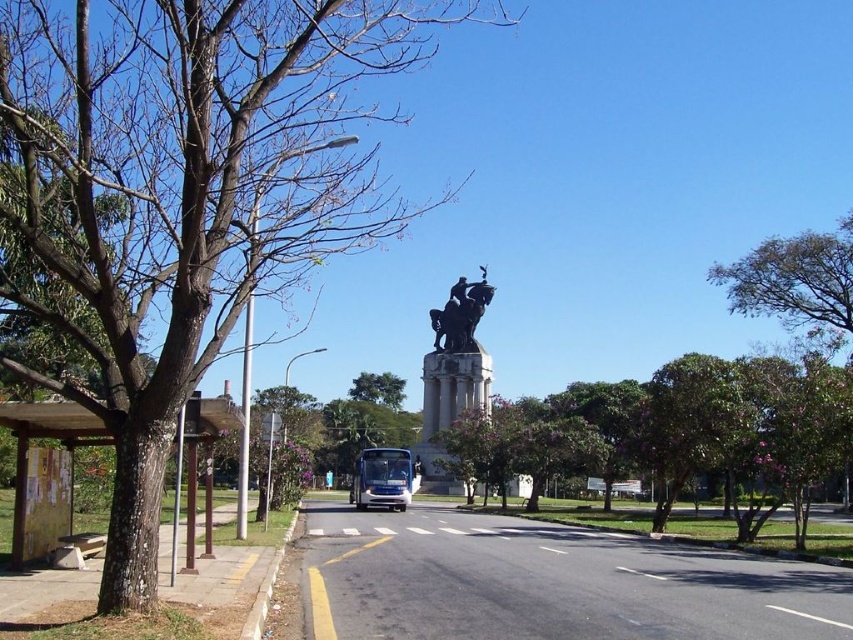
From the picture: You are a tourist standing in the park and want to take a photo of the polished bronze statue at center without the white glossy bus at center appearing in the frame. Which direction should you move to ensure the statue is visible but the bus is out of sight?

Move to the right side of the polished bronze statue at center so that the white glossy bus at center is no longer in the frame.

You are standing in the park and want to reach the statue. The statue is located at point (x=38, y=214). You have a toy car that can travel 100 feet. Can the toy car reach the statue from your current position?

The distance between point (x=38, y=214) and the viewer is 73.41 feet. Since the toy car can travel 100 feet, it can reach the statue.

You are a park visitor who wants to take a photo of the statue. You notice two green leafy trees in the scene. Which tree, the green leafy tree at upper right or the green leafy tree at center, might block your view of the statue if you stand between them?

The green leafy tree at upper right is taller than the green leafy tree at center, so standing between them, the taller green leafy tree at upper right might block your view of the statue more than the shorter one at center.